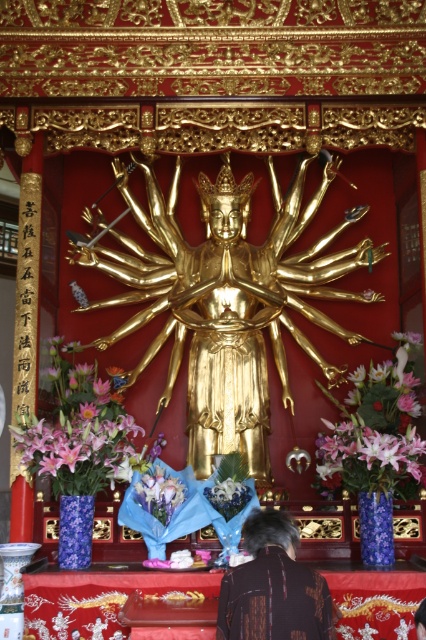
You are a temple caretaker who needs to place a new offering on the altar. You have a small statue that requires a space 2 meters away from any existing pink silk flowers. Can you place it between the pink silk flowers at lower left and the pink silk flowers at center?

The distance between the pink silk flowers at lower left and the pink silk flowers at center is 18.39 meters. Since the required space is only 2 meters away from any existing flowers, placing the offering between them would be feasible as the distance is sufficient.

You are a photographer planning to capture a symmetrical composition of the altar. You notice the brown textured shirt at lower center and the pastel purple bouquet at center. Which object should you position closer to the center to maintain symmetry if one is wider than the other?

The brown textured shirt at lower center might be wider than the pastel purple bouquet at center, so to maintain symmetry, the wider object should be placed closer to the center. Therefore, position the brown textured shirt at lower center closer to the center if it is indeed wider.

You are a temple visitor who wants to place a pink silk offering at the altar. The altar has a golden statue of a multiarmed deity at center. Where should you place the offering so it is closest to the pink silk flowers at lower left?

You should place the offering near the pink silk flowers at lower left, which are located at point [80,432].